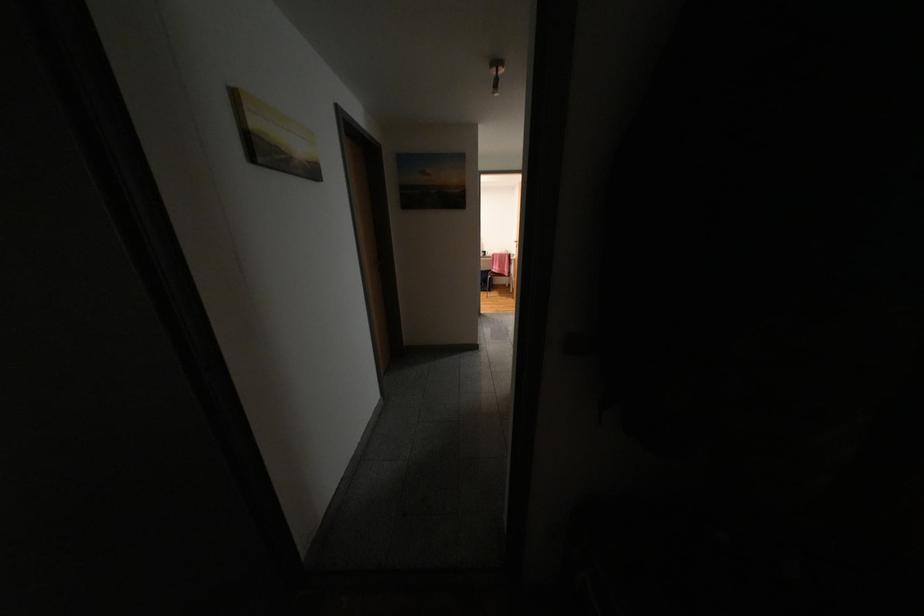
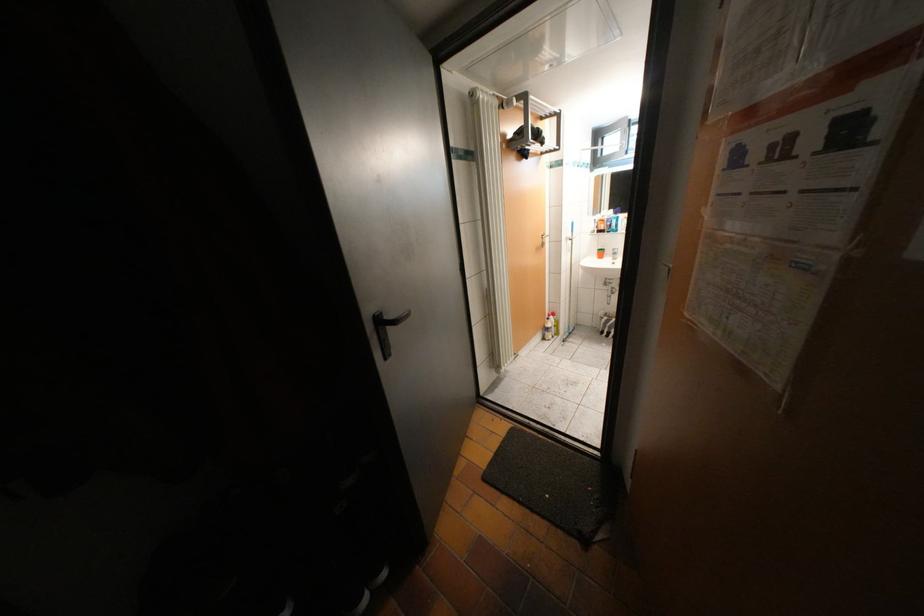
Question: The camera is either moving clockwise (left) or counter-clockwise (right) around the object. The first image is from the beginning of the video and the second image is from the end. Is the camera moving left or right when shooting the video?

Choices:
 (A) Left
 (B) Right

Answer: (A)